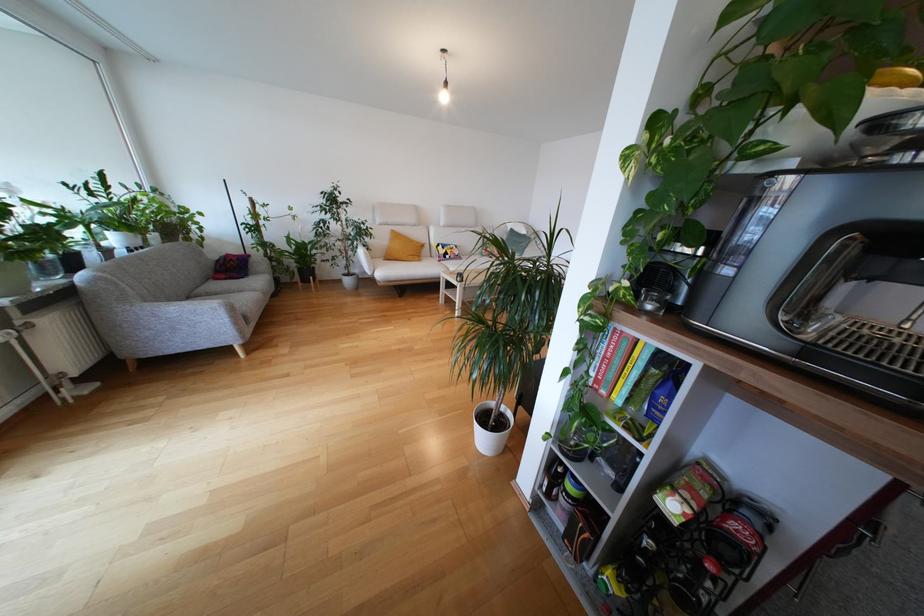
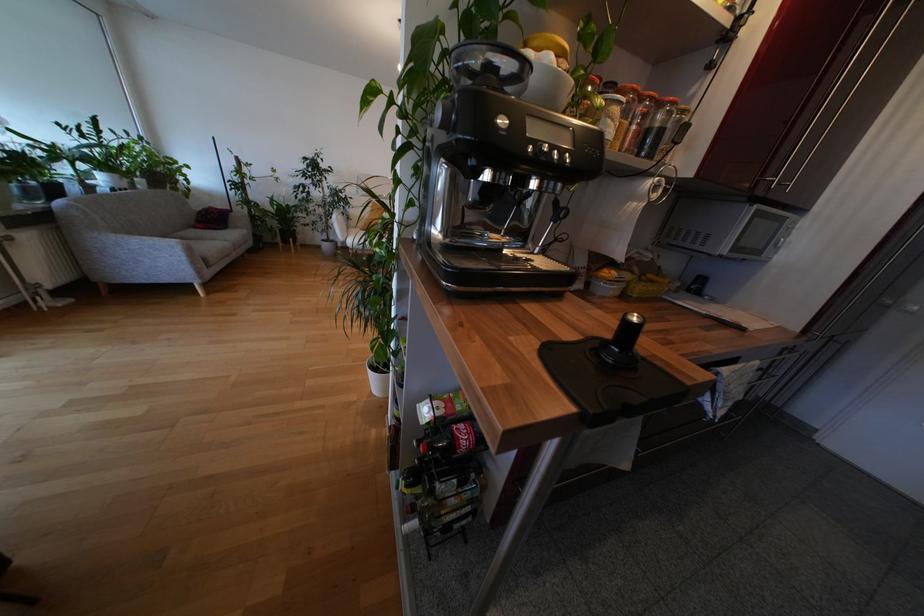
Find the pixel in the second image that matches the point at 774,146 in the first image.

(450, 95)